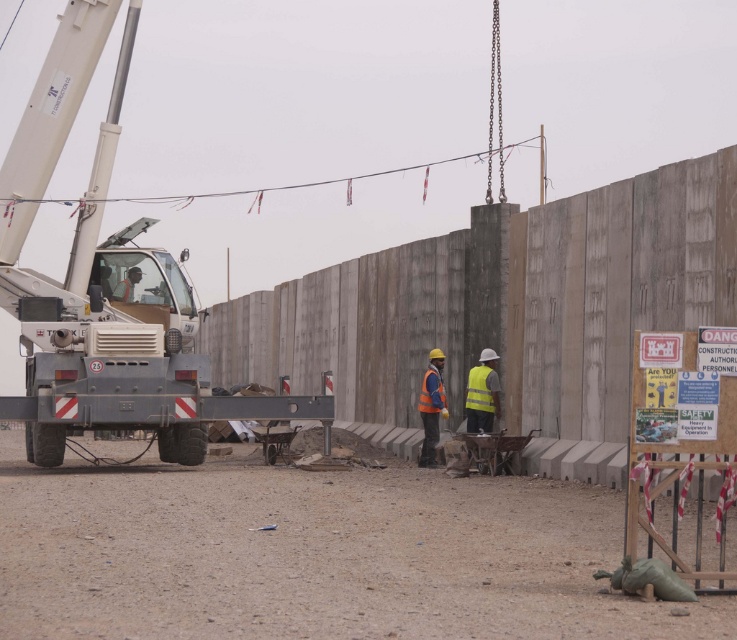
You are a construction worker planning to move a heavy beam from the ground to the crane. Since the gray metallic crane at left is above the orange reflective safety vest at center, will you need to adjust the crane position to avoid the vest?

The gray metallic crane at left is located above the orange reflective safety vest at center, so you need to adjust the crane position to avoid the vest.

You are a construction worker standing at the edge of the construction site. You need to move the orange reflective safety vest at center to the right side of the gray metallic crane at left. Is this possible without moving the crane?

The gray metallic crane at left is to the left of orange reflective safety vest at center, so moving the orange reflective safety vest at center to the right of the crane would require moving it away from its current position, which is already to the right of the crane. Therefore, the vest is already positioned to the right of the crane, so no movement is needed.

You are a safety inspector at the construction site. You need to ensure that the gray metallic crane at left can be seen clearly from the reflective orange vest at center. Given that the crane is larger, would its size help in visibility from that position?

Yes, the gray metallic crane at left is larger in size than the reflective orange vest at center, so its size would aid in visibility from that position.